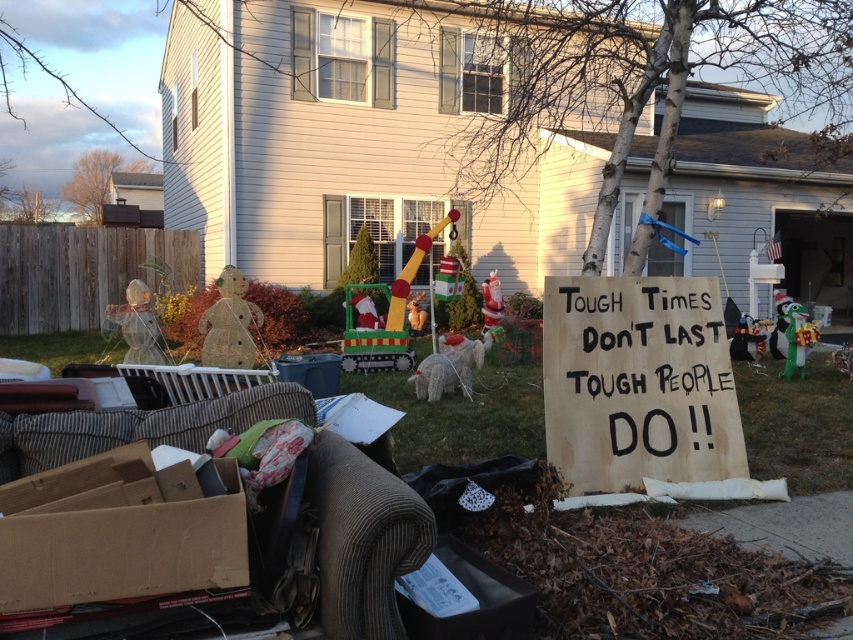
Does brown cardboard sign at center appear over brown cardboard box at lower left?

Correct, brown cardboard sign at center is located above brown cardboard box at lower left.

Consider the image. Between brown cardboard sign at center and brown cardboard box at lower left, which one appears on the left side from the viewer's perspective?

From the viewer's perspective, brown cardboard box at lower left appears more on the left side.

Is point (717, 413) closer to viewer compared to point (142, 484)?

No, (717, 413) is further to viewer.

Where is `brown cardboard sign at center`? brown cardboard sign at center is located at coordinates (637, 381).